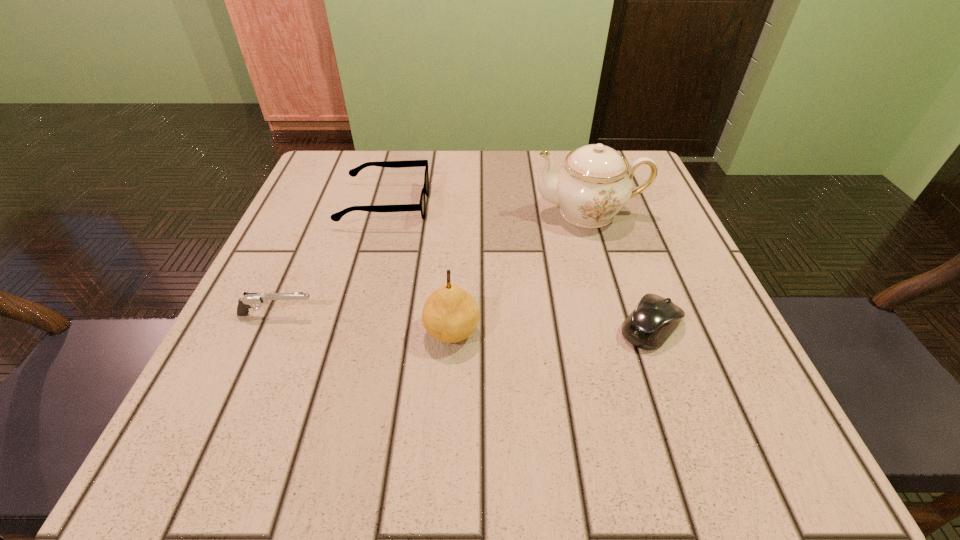
The width and height of the screenshot is (960, 540). Find the location of `free space that satisfies the following two spatial constraints: 1. at the spout of the chinaware; 2. on the front side of the third object from left to right`. free space that satisfies the following two spatial constraints: 1. at the spout of the chinaware; 2. on the front side of the third object from left to right is located at coordinates (625, 331).

Where is `free space that satisfies the following two spatial constraints: 1. on the front-facing side of the pistol; 2. on the right side of the pear`? This screenshot has width=960, height=540. free space that satisfies the following two spatial constraints: 1. on the front-facing side of the pistol; 2. on the right side of the pear is located at coordinates (270, 331).